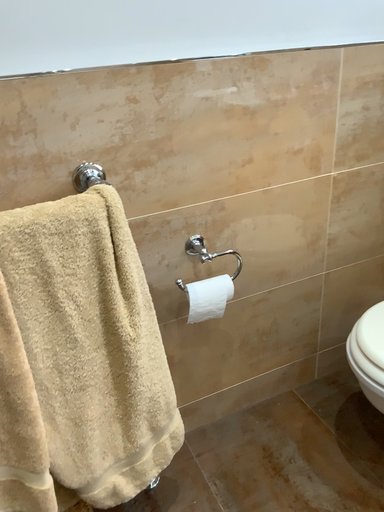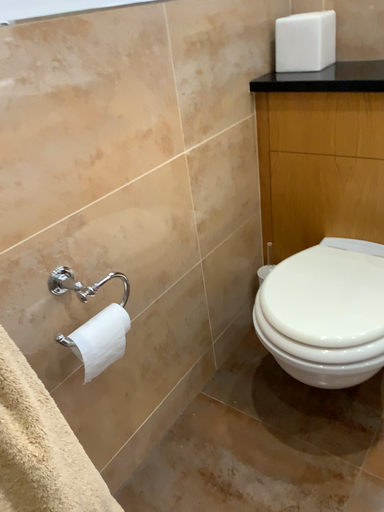
Question: How did the camera likely rotate when shooting the video?

Choices:
 (A) rotated right
 (B) rotated left

Answer: (A)